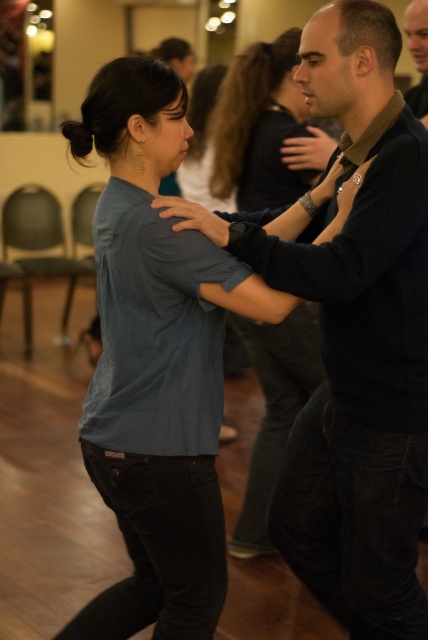
Question: Is blue denim shirt at center positioned before smooth black shirt at upper right?

Choices:
 (A) yes
 (B) no

Answer: (A)

Question: Which of the following is the closest to the observer?

Choices:
 (A) (422, 113)
 (B) (228, 77)

Answer: (B)

Question: Which point appears closest to the camera in this image?

Choices:
 (A) (419, 92)
 (B) (234, 60)

Answer: (B)

Question: Is blue denim shirt at center thinner than smooth black shirt at upper right?

Choices:
 (A) yes
 (B) no

Answer: (B)

Question: Which point is closer to the camera taking this photo?

Choices:
 (A) (421, 65)
 (B) (264, 138)

Answer: (B)

Question: Can you confirm if blue denim shirt at center is positioned above smooth black shirt at upper right?

Choices:
 (A) yes
 (B) no

Answer: (B)